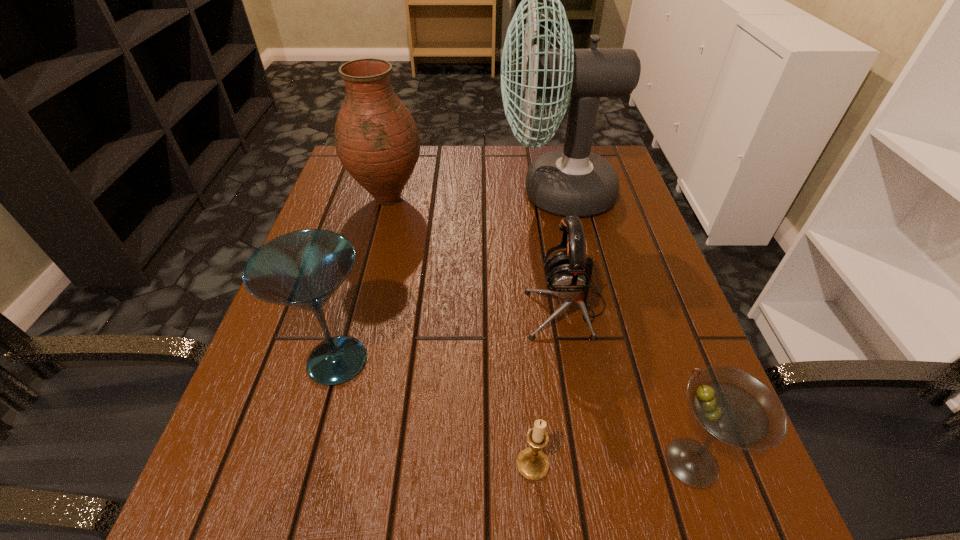
Locate an element on the screen. This screenshot has height=540, width=960. blank space located 0.360m in front of the fan where the airflow is directed is located at coordinates (356, 193).

Locate an element on the screen. vacant area located on the back of the second tallest object is located at coordinates (396, 164).

Find the location of a particular element. The width and height of the screenshot is (960, 540). free space located on the left of the taller martini is located at coordinates (259, 361).

Where is `vacant space located 0.280m on the front of the earphone`? vacant space located 0.280m on the front of the earphone is located at coordinates (602, 507).

At what (x,y) coordinates should I click in order to perform the action: click on vacant space positioned on the back of the shorter martini. Please return your answer as a coordinate pair (x, y). The image size is (960, 540). Looking at the image, I should click on (659, 365).

The image size is (960, 540). In order to click on vacant space located 0.060m on the front of the candle holder in this screenshot , I will do `click(538, 529)`.

This screenshot has height=540, width=960. I want to click on fan present at the far edge, so click(573, 181).

This screenshot has width=960, height=540. Find the location of `vase positioned at the far edge`. vase positioned at the far edge is located at coordinates (377, 140).

You are a GUI agent. You are given a task and a screenshot of the screen. Output one action in this format:
    pyautogui.click(x=<x>, y=<y>)
    Task: Click on the object at the near edge
    The width and height of the screenshot is (960, 540).
    Given the screenshot: What is the action you would take?
    pyautogui.click(x=733, y=406)

The image size is (960, 540). What are the coordinates of `vase at the left edge` in the screenshot? It's located at click(377, 140).